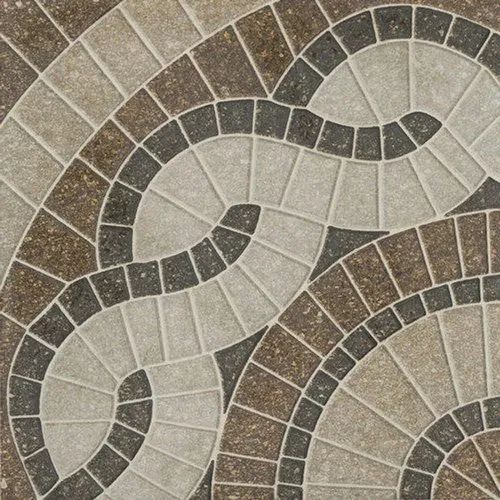
Where is `intersection of two grout lines`? This screenshot has width=500, height=500. intersection of two grout lines is located at coordinates (211, 352).